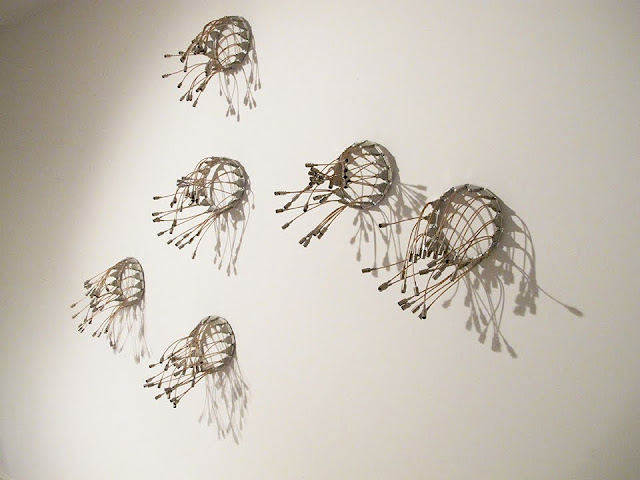
The height and width of the screenshot is (480, 640). Identify the location of sculptures. coord(203,337), coord(123,274), coord(236,179), coord(355,163), coord(484,231), coord(224,41).